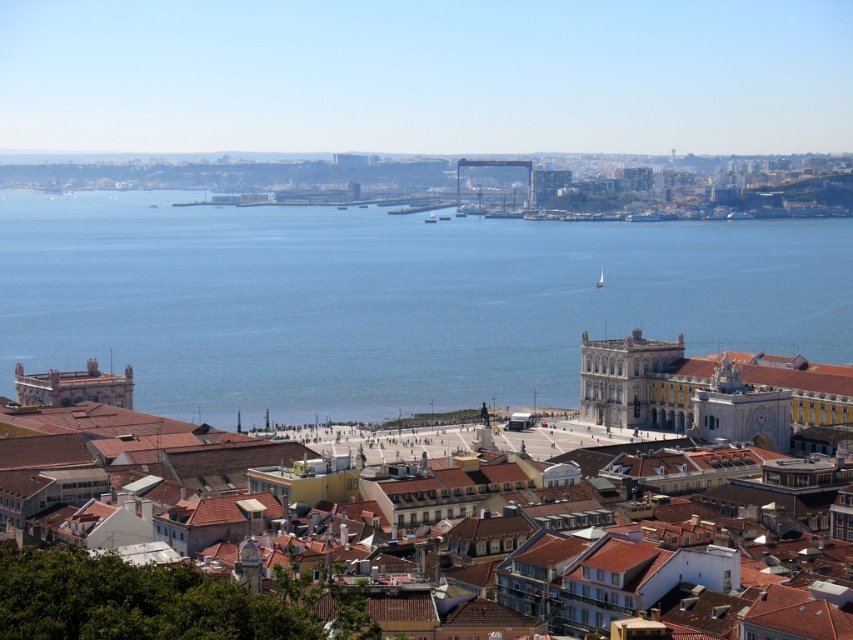
You are a tourist standing at the edge of the Tagus River in Lisbon. You notice a point marked at coordinates (389,300) in the image. Based on the scene, can you determine if this point is located on the water or on land?

The point (389,300) is on blue water at center, so it is located on the water.